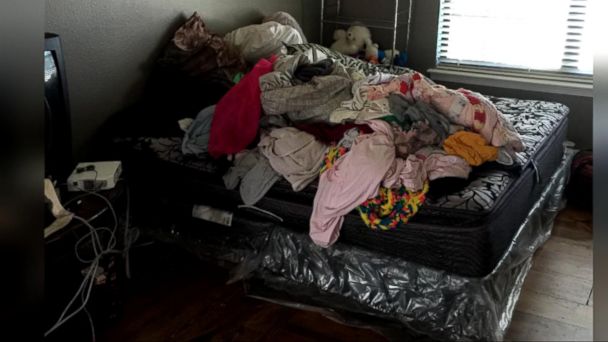
The image size is (608, 342). Identify the location of chrome shelving unit. (395, 30).